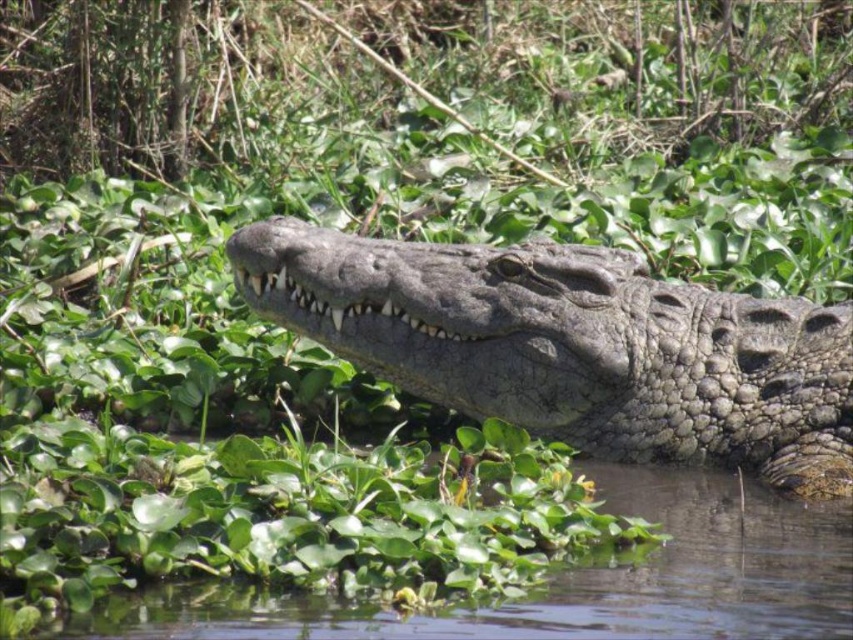
Question: Can you confirm if rough textured crocodile at center is positioned to the left of clear water at center?

Choices:
 (A) yes
 (B) no

Answer: (A)

Question: Observing the image, what is the correct spatial positioning of rough textured crocodile at center in reference to clear water at center?

Choices:
 (A) above
 (B) below

Answer: (A)

Question: Which object appears farthest from the camera in this image?

Choices:
 (A) rough textured crocodile at center
 (B) clear water at center

Answer: (A)

Question: Which point is farther from the camera taking this photo?

Choices:
 (A) (555, 378)
 (B) (705, 579)

Answer: (A)

Question: Among these objects, which one is nearest to the camera?

Choices:
 (A) clear water at center
 (B) rough textured crocodile at center

Answer: (A)

Question: Does rough textured crocodile at center appear under clear water at center?

Choices:
 (A) yes
 (B) no

Answer: (B)